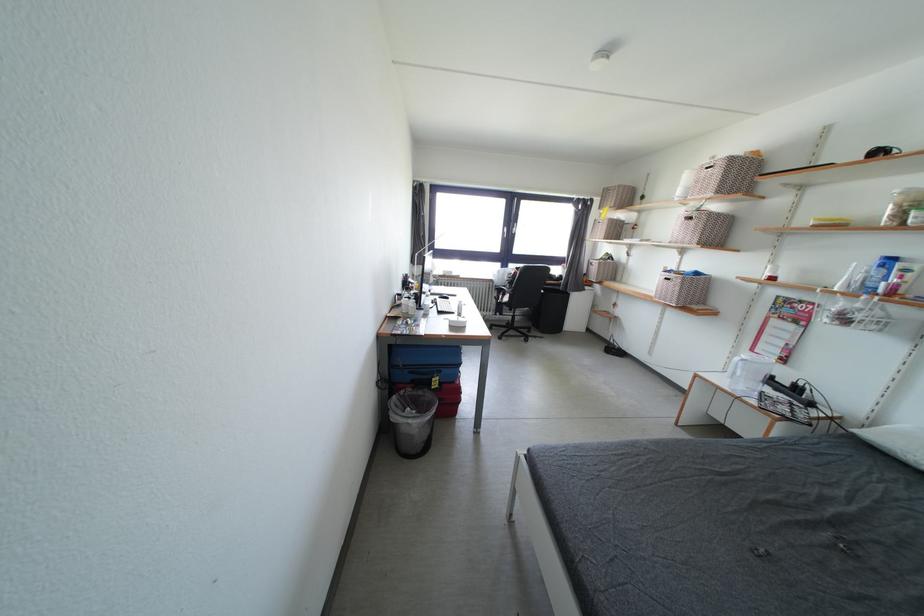
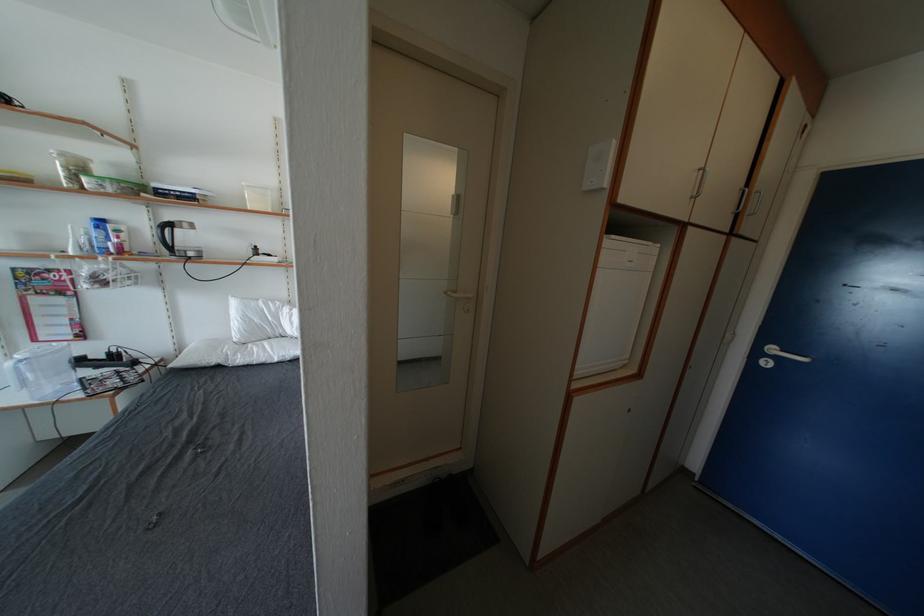
Find the pixel in the second image that matches [889,270] in the first image.

(103, 232)